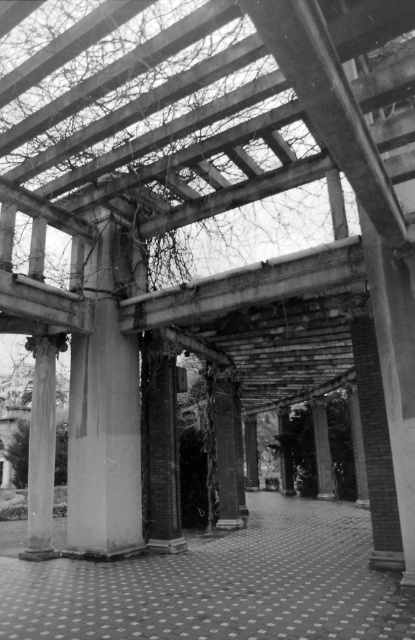
Is concrete column at center below smooth concrete pillar at center?

No.

Can you confirm if concrete column at center is positioned above smooth concrete pillar at center?

Yes, concrete column at center is above smooth concrete pillar at center.

Identify the location of concrete column at center. (104, 413).

Can you confirm if concrete column at center is positioned to the left of smooth concrete column at center?

Incorrect, concrete column at center is not on the left side of smooth concrete column at center.

How much distance is there between concrete column at center and smooth concrete column at center?

concrete column at center and smooth concrete column at center are 2.62 meters apart from each other.

Between point (73, 412) and point (43, 408), which one is positioned in front?

Point (73, 412)

At what (x,y) coordinates should I click in order to perform the action: click on concrete column at center. Please return your answer as a coordinate pair (x, y). This screenshot has width=415, height=640. Looking at the image, I should click on (104, 413).

Locate an element on the screen. The width and height of the screenshot is (415, 640). smooth concrete column at center is located at coordinates (41, 451).